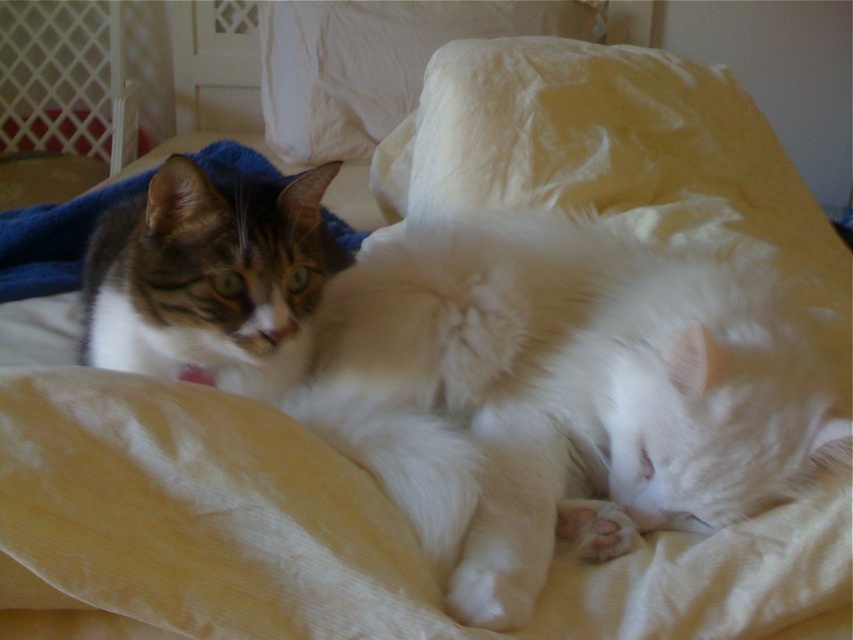
Question: Which of these objects is positioned farthest from the tabby fur cat at upper left?

Choices:
 (A) white soft pillow at upper center
 (B) blue soft blanket at upper left

Answer: (A)

Question: Which point appears closest to the camera in this image?

Choices:
 (A) (254, 356)
 (B) (433, 253)

Answer: (A)

Question: Can you confirm if tabby fur cat at upper left is positioned to the left of white soft pillow at upper center?

Choices:
 (A) no
 (B) yes

Answer: (B)

Question: Which point is farther from the camera taking this photo?

Choices:
 (A) (285, 22)
 (B) (270, 280)
 (C) (347, 248)
 (D) (782, 480)

Answer: (A)

Question: Does tabby fur cat at left have a lesser width compared to white soft pillow at upper center?

Choices:
 (A) no
 (B) yes

Answer: (B)

Question: Is tabby fur cat at left to the right of blue soft blanket at upper left from the viewer's perspective?

Choices:
 (A) yes
 (B) no

Answer: (A)